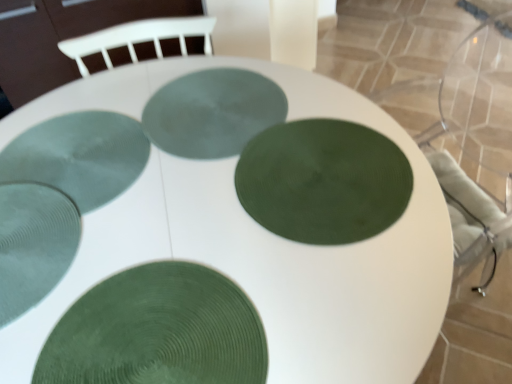
At what (x,y) coordinates should I click in order to perform the action: click on free space between green textured glass plate at center, which ranks as the third glass plate in front-to-back order, and green textured glass plate at center, arranged as the fourth glass plate when viewed from the front. Please return your answer as a coordinate pair (x, y). Image resolution: width=512 pixels, height=384 pixels. Looking at the image, I should click on (189, 166).